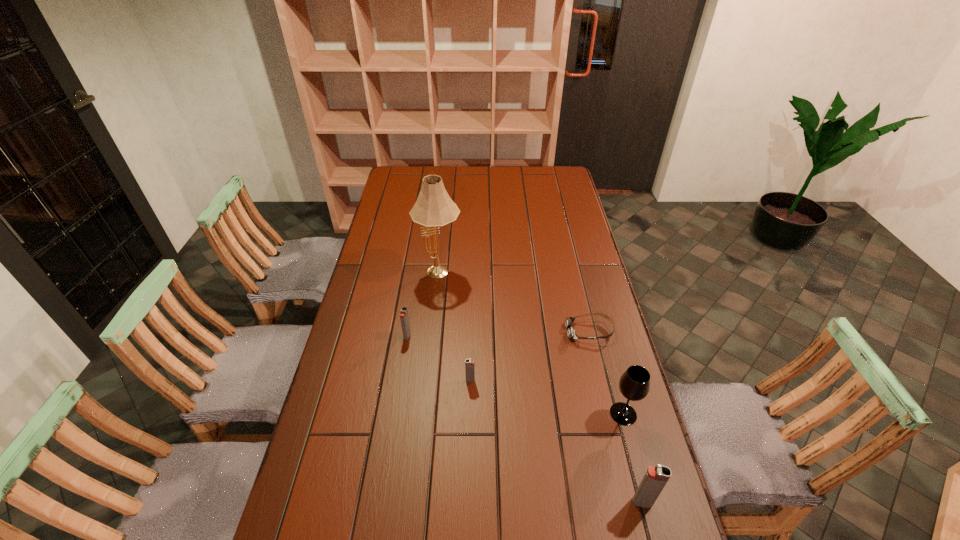
Identify the location of free space between the farthest object and the shortest object. This screenshot has width=960, height=540. (515, 303).

The width and height of the screenshot is (960, 540). Find the location of `free space between the fifth tallest object and the lampshade`. free space between the fifth tallest object and the lampshade is located at coordinates (455, 327).

The image size is (960, 540). I want to click on free spot between the nearest igniter and the fifth farthest object, so click(x=633, y=458).

You are a GUI agent. You are given a task and a screenshot of the screen. Output one action in this format:
    pyautogui.click(x=<x>, y=<y>)
    Task: Click on the vacant space that is in between the second igniter from left to right and the fifth farthest object
    
    Given the screenshot: What is the action you would take?
    pyautogui.click(x=547, y=397)

Where is `vacant region between the tallest igniter and the farthest object`? vacant region between the tallest igniter and the farthest object is located at coordinates (540, 388).

At what (x,y) coordinates should I click in order to perform the action: click on free space between the second shortest igniter and the second igniter from left to right. Please return your answer as a coordinate pair (x, y). The image size is (960, 540). Looking at the image, I should click on (439, 358).

Image resolution: width=960 pixels, height=540 pixels. In order to click on vacant space that's between the lampshade and the wineglass in this screenshot , I will do `click(532, 344)`.

Locate an element on the screen. Image resolution: width=960 pixels, height=540 pixels. free space between the second igniter from left to right and the farthest igniter is located at coordinates (439, 358).

Where is `object that stands as the fifth closest to the goggles`? This screenshot has width=960, height=540. object that stands as the fifth closest to the goggles is located at coordinates 404,318.

Find the location of a particular element. This screenshot has height=540, width=960. object that is the fifth closest one to the fourth tallest object is located at coordinates (655, 478).